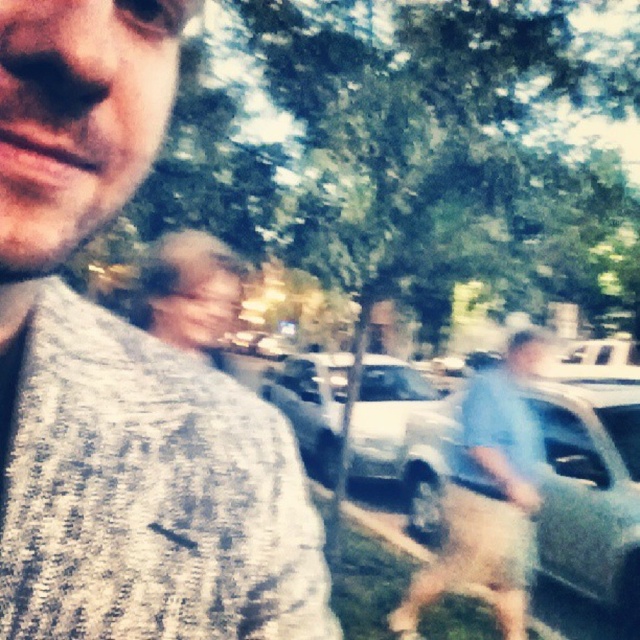
Question: Does gray knitted sweater at left appear on the right side of metallic silver car at center?

Choices:
 (A) yes
 (B) no

Answer: (B)

Question: Among these objects, which one is farthest from the camera?

Choices:
 (A) gray knitted sweater at left
 (B) metallic silver car at center
 (C) blue fabric shirt at center

Answer: (B)

Question: Which point is farther to the camera?

Choices:
 (A) (472, 387)
 (B) (147, 584)
 (C) (637, 573)

Answer: (C)

Question: Can you confirm if metallic silver car at center is positioned to the left of blue fabric shirt at center?

Choices:
 (A) yes
 (B) no

Answer: (B)

Question: Can you confirm if metallic silver car at center is positioned to the left of blue fabric shirt at center?

Choices:
 (A) no
 (B) yes

Answer: (A)

Question: Which point is closer to the camera?

Choices:
 (A) (422, 416)
 (B) (529, 484)

Answer: (B)